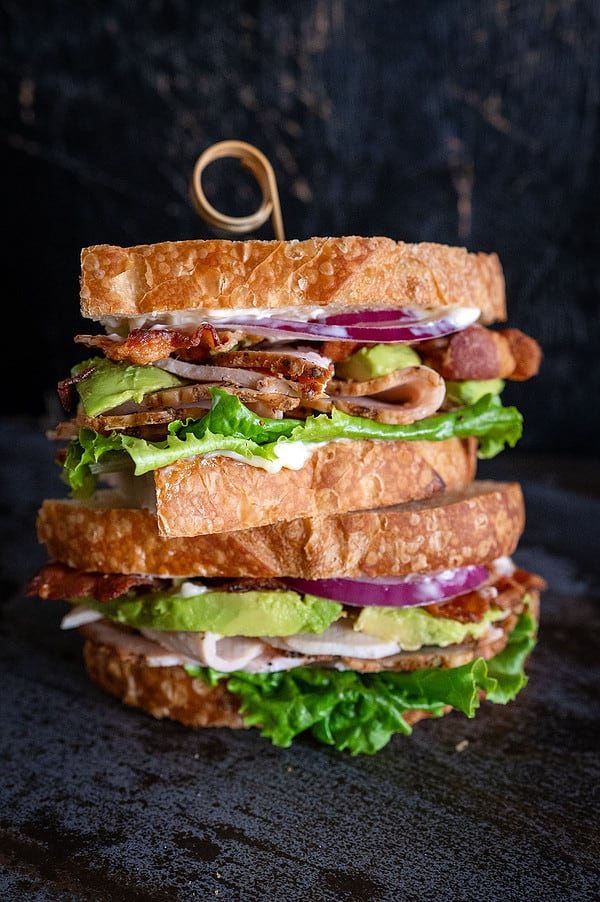
You are a GUI agent. You are given a task and a screenshot of the screen. Output one action in this format:
    pyautogui.click(x=<x>, y=<y>)
    Task: Click on the table
    
    Given the screenshot: What is the action you would take?
    pyautogui.click(x=356, y=812)